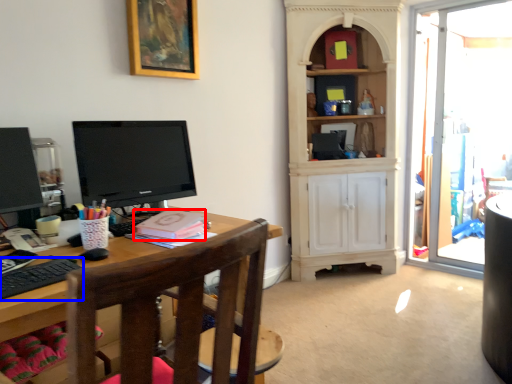
Question: Which of the following is the farthest to the observer, book (highlighted by a red box) or computer keyboard (highlighted by a blue box)?

Choices:
 (A) book
 (B) computer keyboard

Answer: (A)